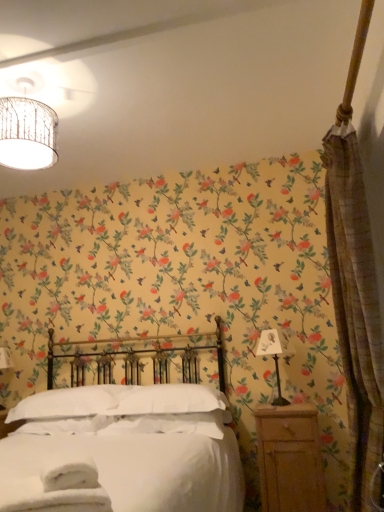
This screenshot has width=384, height=512. What are the coordinates of `free space above matte woven lampshade at upper left (from a real-world perspective)` in the screenshot? It's located at (21, 74).